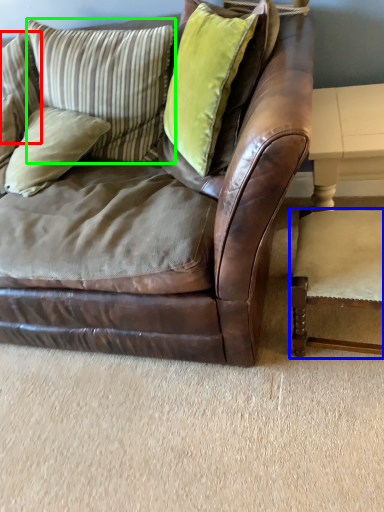
Question: Estimate the real-world distances between objects in this image. Which object is farther from pillow (highlighted by a red box), chair (highlighted by a blue box) or pillow (highlighted by a green box)?

Choices:
 (A) chair
 (B) pillow

Answer: (A)